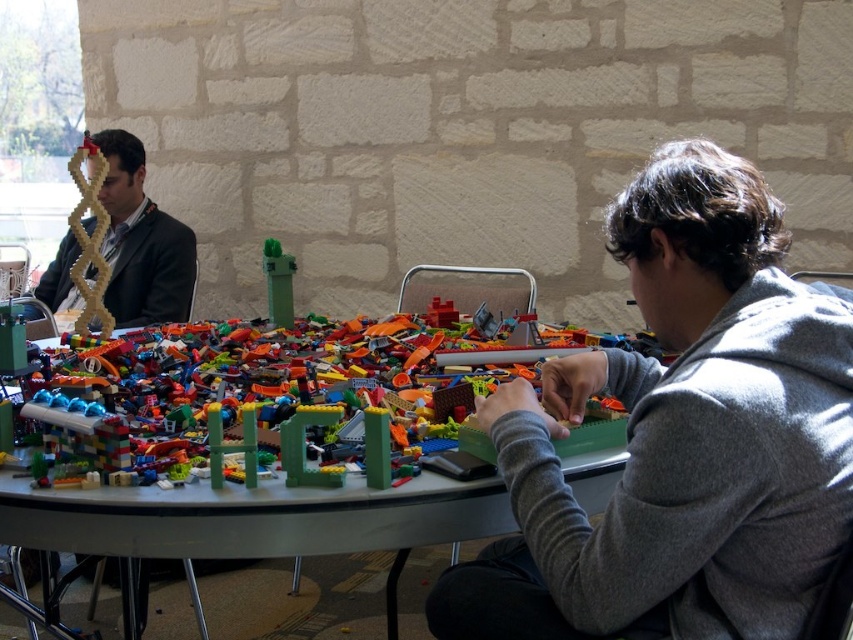
Who is lower down, multicolored plastic lego bricks at center or translucent plastic lego bricks at center?

Positioned lower is multicolored plastic lego bricks at center.

Is point (589, 444) more distant than point (96, 412)?

Yes, point (589, 444) is behind point (96, 412).

What do you see at coordinates (251, 516) in the screenshot? Image resolution: width=853 pixels, height=640 pixels. I see `multicolored plastic lego bricks at center` at bounding box center [251, 516].

Locate an element on the screen. multicolored plastic lego bricks at center is located at coordinates (251, 516).

Is multicolored plastic lego bricks at center closer to the viewer compared to matte black suit at left?

Yes, multicolored plastic lego bricks at center is in front of matte black suit at left.

Who is positioned more to the right, multicolored plastic lego bricks at center or matte black suit at left?

From the viewer's perspective, multicolored plastic lego bricks at center appears more on the right side.

In order to click on multicolored plastic lego bricks at center in this screenshot , I will do `click(251, 516)`.

Does translucent plastic lego bricks at center have a greater width compared to matte black suit at left?

Yes.

Who is lower down, translucent plastic lego bricks at center or matte black suit at left?

translucent plastic lego bricks at center

I want to click on translucent plastic lego bricks at center, so click(x=300, y=442).

This screenshot has width=853, height=640. What are the coordinates of `translucent plastic lego bricks at center` in the screenshot? It's located at (300, 442).